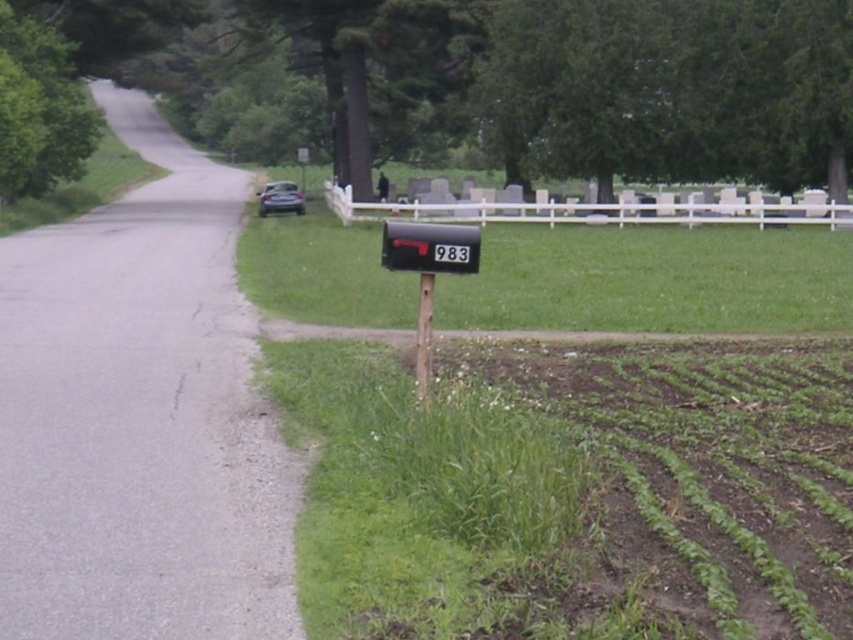
You are a gardener who needs to mow the lawn. You see the green grass at lower right and the metallic black mailbox at center. Which area should you avoid mowing to prevent damaging any objects?

You should avoid mowing the area around the metallic black mailbox at center because the green grass at lower right is bigger and likely part of the lawn, while the mailbox is a fixed object mounted on a post.

You are a gardener who needs to mow the lawn. You see the green grass at lower right and the metallic mailbox at center. Which area should you avoid mowing to prevent damaging any objects?

You should avoid mowing the metallic mailbox at center because it is smaller than the green grass at lower right, so it is more likely to be in the way of the lawnmower.

You are standing at the center of the image and want to walk towards the green grass at lower right. Which direction should you face to head directly towards it?

The green grass at lower right is located at point (573,492), so you should face towards the lower right direction to head directly towards it.